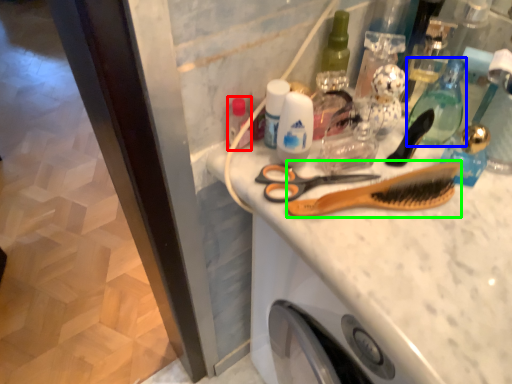
Question: Estimate the real-world distances between objects in this image. Which object is closer to toiletry (highlighted by a red box), mouthwash (highlighted by a blue box) or comb (highlighted by a green box)?

Choices:
 (A) mouthwash
 (B) comb

Answer: (B)